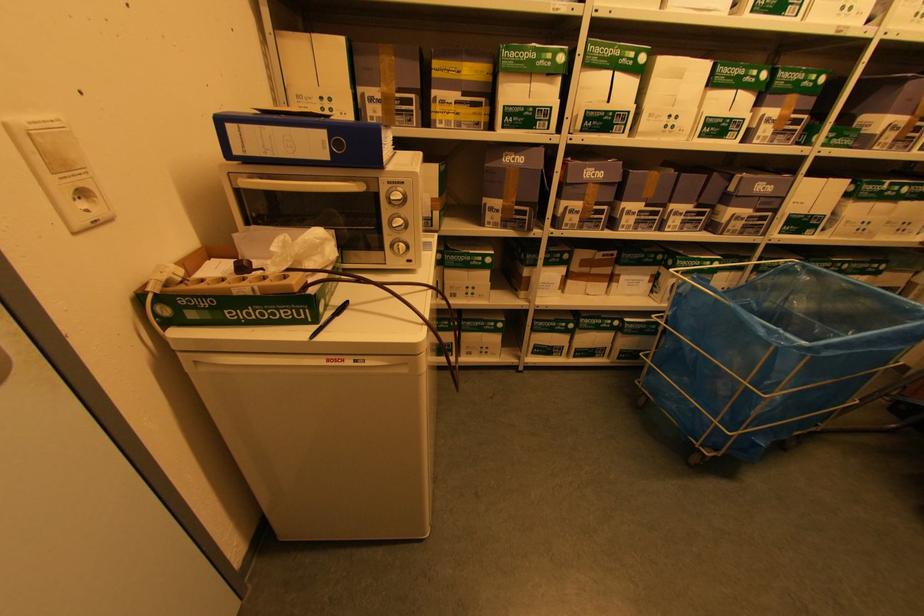
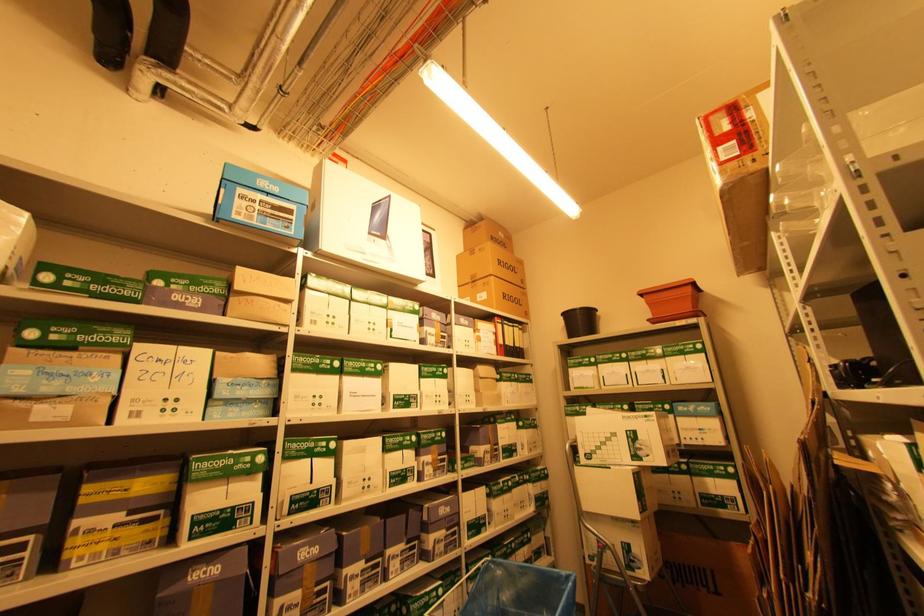
First-person continuous shooting, in which direction is the camera rotating?

The camera's rotation is toward right-up.